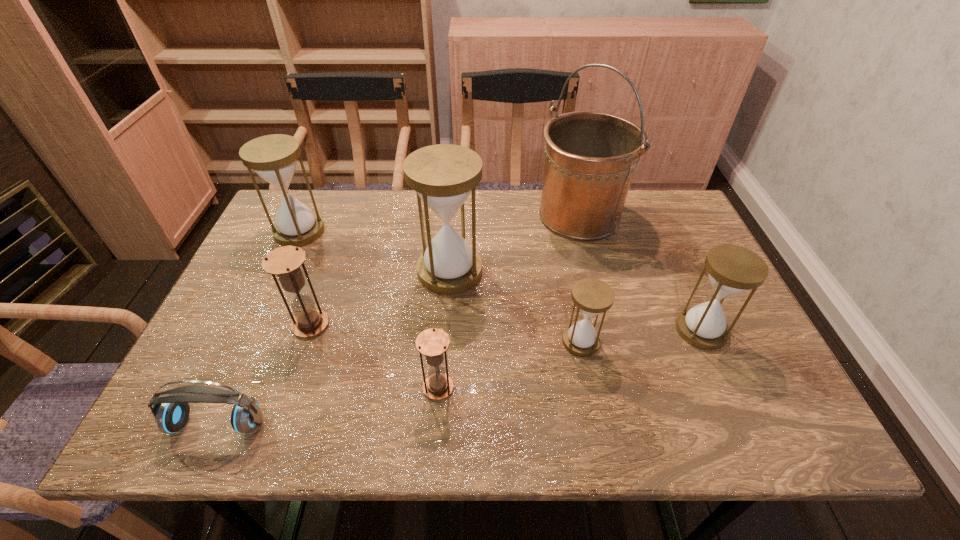
Identify the location of the tallest object. The width and height of the screenshot is (960, 540). [590, 157].

Locate an element on the screen. The image size is (960, 540). the third nearest white hourglass is located at coordinates (443, 175).

Where is `the third farthest object`? the third farthest object is located at coordinates (443, 175).

Identify the location of the fifth shortest hourglass. The image size is (960, 540). (273, 157).

Image resolution: width=960 pixels, height=540 pixels. I want to click on the farthest white hourglass, so click(x=273, y=157).

Image resolution: width=960 pixels, height=540 pixels. Find the location of `the bigger brown hourglass`. the bigger brown hourglass is located at coordinates (285, 262).

Locate an element on the screen. This screenshot has height=540, width=960. the farther brown hourglass is located at coordinates (285, 262).

In order to click on the rightmost hourglass in this screenshot , I will do `click(732, 270)`.

Where is `the third biggest white hourglass`? This screenshot has height=540, width=960. the third biggest white hourglass is located at coordinates (732, 270).

The width and height of the screenshot is (960, 540). In order to click on the second hourglass from right to left in this screenshot , I will do 591,296.